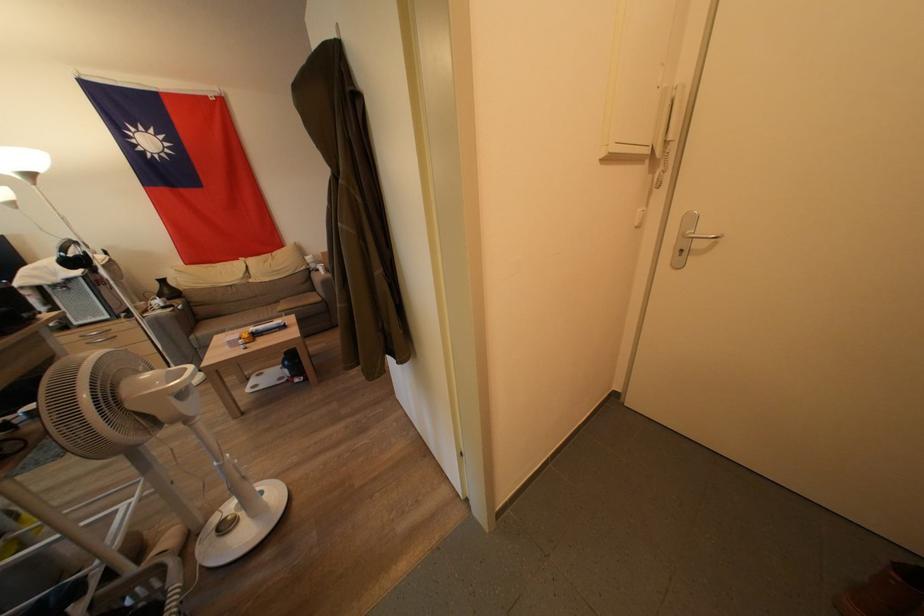
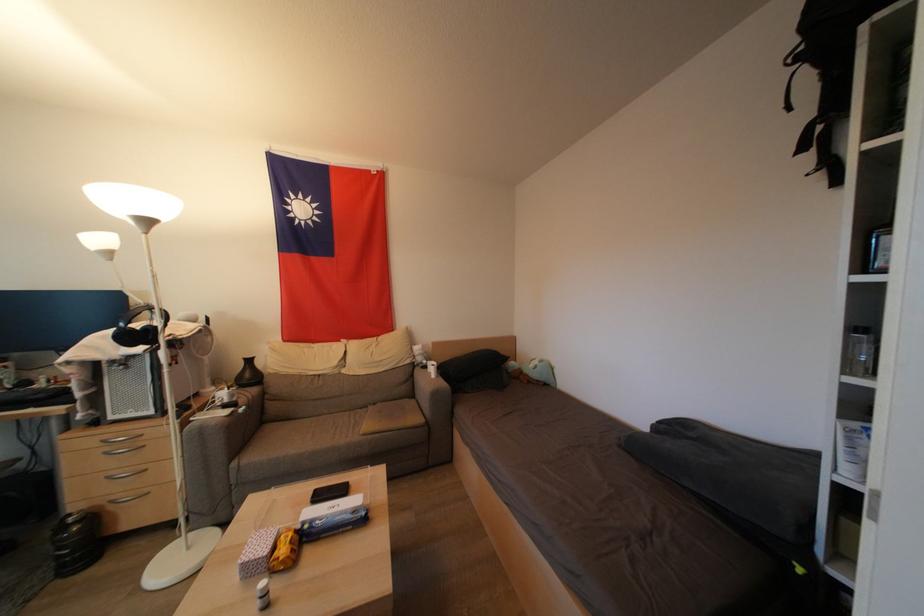
In the second image, find the point that corresponds to (x=34, y=179) in the first image.

(152, 225)